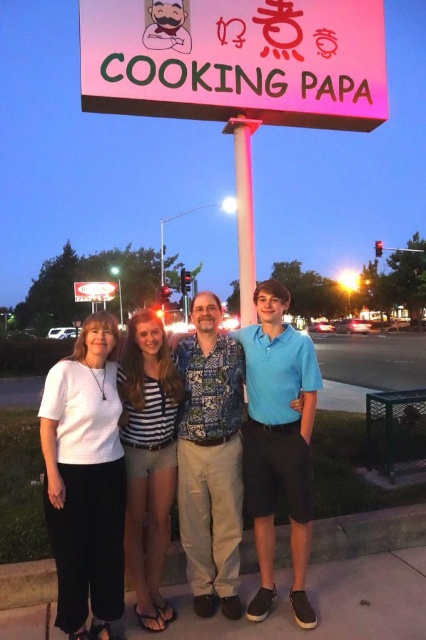
Question: Can you confirm if white cotton shirt at center is bigger than metallic pole at center?

Choices:
 (A) yes
 (B) no

Answer: (B)

Question: Observing the image, what is the correct spatial positioning of pink neon sign at upper center in reference to metallic pole at center?

Choices:
 (A) above
 (B) below

Answer: (B)

Question: Which point is farther from the camera taking this photo?

Choices:
 (A) (367, 58)
 (B) (276, 372)

Answer: (A)

Question: Which point is farther to the camera?

Choices:
 (A) white cotton shirt at center
 (B) pink neon sign at upper center

Answer: (B)

Question: Is white cotton shirt at center bigger than white matte shirt at left?

Choices:
 (A) yes
 (B) no

Answer: (A)

Question: Which of the following is the farthest from the observer?

Choices:
 (A) metallic pole at center
 (B) striped fabric shorts at center
 (C) white cotton shirt at center

Answer: (A)